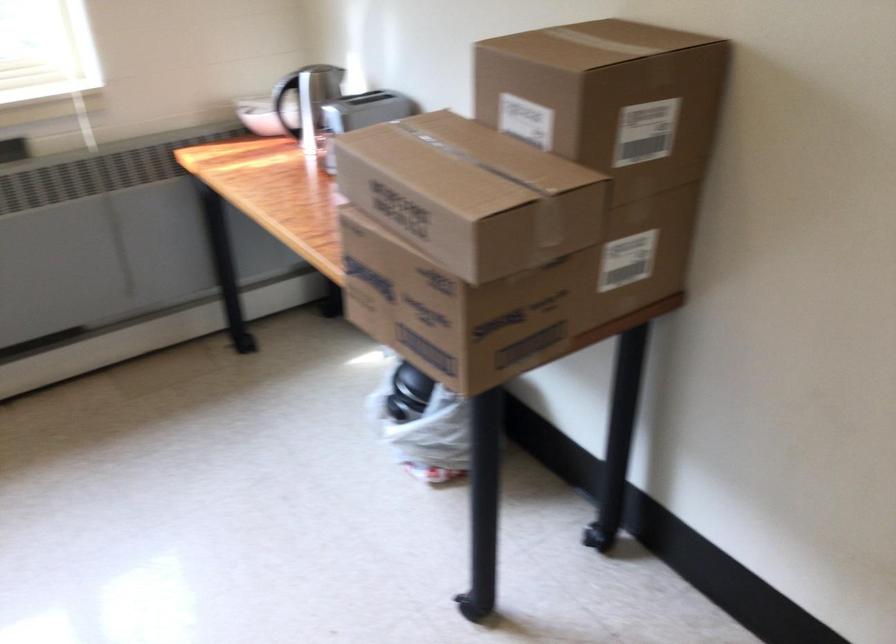
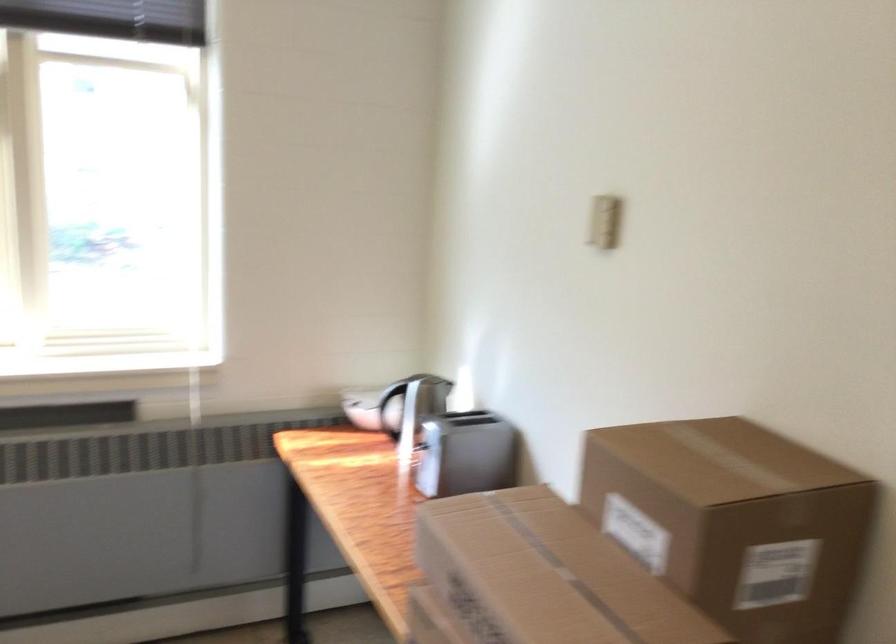
Question: The images are taken continuously from a first-person perspective. In which direction are you moving?

Choices:
 (A) Left
 (B) Right
 (C) Forward
 (D) Backward

Answer: (C)